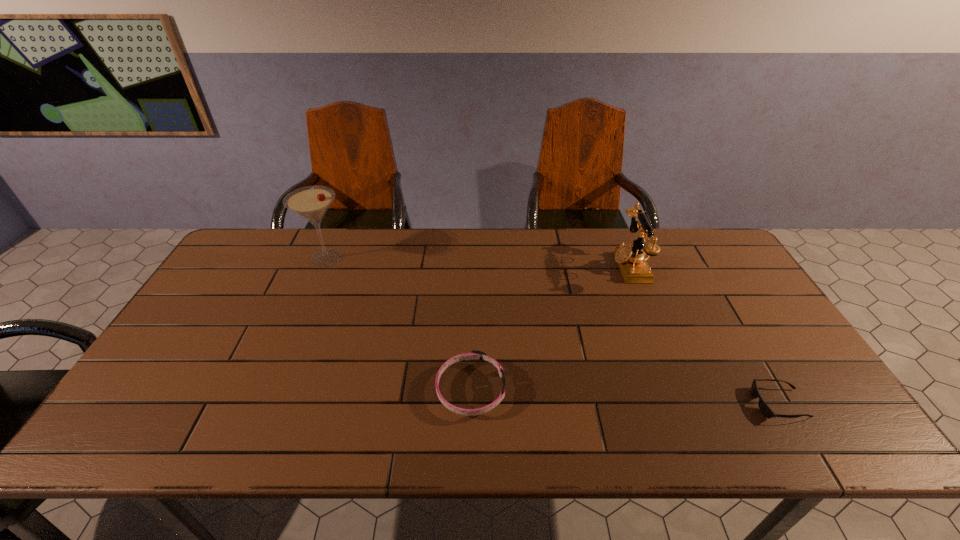
The image size is (960, 540). I want to click on free point between the dog collar and the tallest object, so click(398, 324).

Where is `free space between the shortest object and the second object from right to left`? Image resolution: width=960 pixels, height=540 pixels. free space between the shortest object and the second object from right to left is located at coordinates (705, 335).

At what (x,y) coordinates should I click in order to perform the action: click on empty space between the dog collar and the leftmost object. Please return your answer as a coordinate pair (x, y). Looking at the image, I should click on (398, 324).

The image size is (960, 540). In order to click on unoccupied area between the tallest object and the second object from left to right in this screenshot , I will do `click(398, 324)`.

I want to click on vacant space that's between the martini and the second shortest object, so click(x=398, y=324).

Locate an element on the screen. The width and height of the screenshot is (960, 540). free space between the third object from left to right and the rightmost object is located at coordinates (705, 335).

At what (x,y) coordinates should I click in order to perform the action: click on object that stands as the closest to the third object from left to right. Please return your answer as a coordinate pair (x, y). The height and width of the screenshot is (540, 960). Looking at the image, I should click on (764, 408).

Point out which object is positioned as the nearest to the tallest object. Please provide its 2D coordinates. Your answer should be formatted as a tuple, i.e. [(x, y)], where the tuple contains the x and y coordinates of a point satisfying the conditions above.

[(474, 355)]